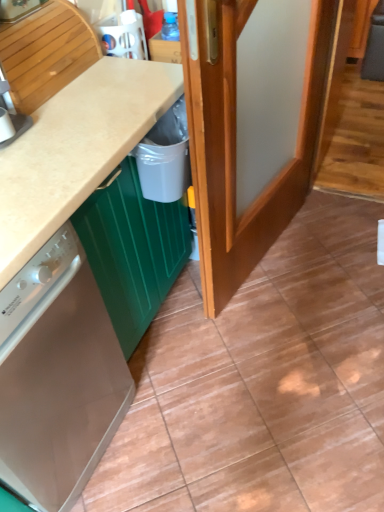
Question: Can you confirm if satin white dishwasher at lower left is wider than wooden door at center?

Choices:
 (A) no
 (B) yes

Answer: (B)

Question: Does satin white dishwasher at lower left have a smaller size compared to wooden door at center?

Choices:
 (A) yes
 (B) no

Answer: (B)

Question: Would you say satin white dishwasher at lower left is a long distance from wooden door at center?

Choices:
 (A) yes
 (B) no

Answer: (B)

Question: Does satin white dishwasher at lower left contain wooden door at center?

Choices:
 (A) no
 (B) yes

Answer: (A)

Question: Can you confirm if satin white dishwasher at lower left is positioned to the right of wooden door at center?

Choices:
 (A) no
 (B) yes

Answer: (A)

Question: Considering the positions of white plastic bin at lower center and satin white dishwasher at lower left in the image, is white plastic bin at lower center taller or shorter than satin white dishwasher at lower left?

Choices:
 (A) short
 (B) tall

Answer: (A)

Question: Is point (142, 144) closer or farther from the camera than point (82, 396)?

Choices:
 (A) farther
 (B) closer

Answer: (B)

Question: Looking at their shapes, would you say white plastic bin at lower center is wider or thinner than satin white dishwasher at lower left?

Choices:
 (A) wide
 (B) thin

Answer: (B)

Question: Is white plastic bin at lower center bigger or smaller than satin white dishwasher at lower left?

Choices:
 (A) big
 (B) small

Answer: (B)

Question: Would you say brushed metal dishwasher at left is inside or outside beige matte countertop at center?

Choices:
 (A) inside
 (B) outside

Answer: (B)

Question: Looking at the image, does brushed metal dishwasher at left seem bigger or smaller compared to beige matte countertop at center?

Choices:
 (A) big
 (B) small

Answer: (B)

Question: From the image's perspective, is brushed metal dishwasher at left above or below beige matte countertop at center?

Choices:
 (A) above
 (B) below

Answer: (A)

Question: From a real-world perspective, is brushed metal dishwasher at left positioned above or below beige matte countertop at center?

Choices:
 (A) above
 (B) below

Answer: (A)

Question: Is brushed metal dishwasher at left spatially inside white plastic bin at lower center, or outside of it?

Choices:
 (A) inside
 (B) outside

Answer: (B)

Question: Based on their positions, is brushed metal dishwasher at left located to the left or right of white plastic bin at lower center?

Choices:
 (A) left
 (B) right

Answer: (A)